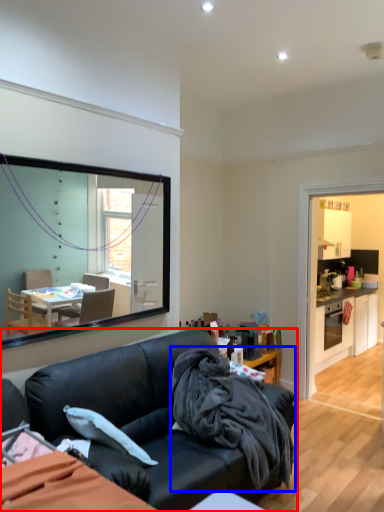
Question: Which of the following is the farthest to the observer, studio couch (highlighted by a red box) or blanket (highlighted by a blue box)?

Choices:
 (A) studio couch
 (B) blanket

Answer: (B)